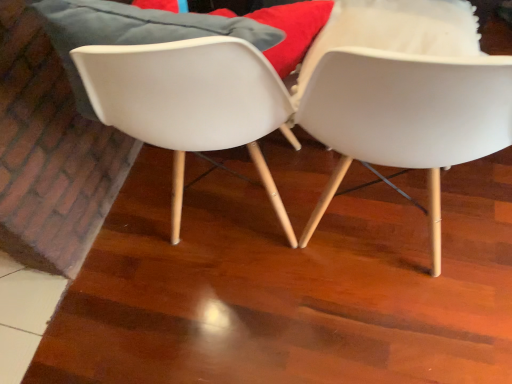
This screenshot has height=384, width=512. In order to click on vacant area situated below white matte chair at center, which is counted as the 1th chair, starting from the right (from a real-world perspective) in this screenshot , I will do `click(375, 223)`.